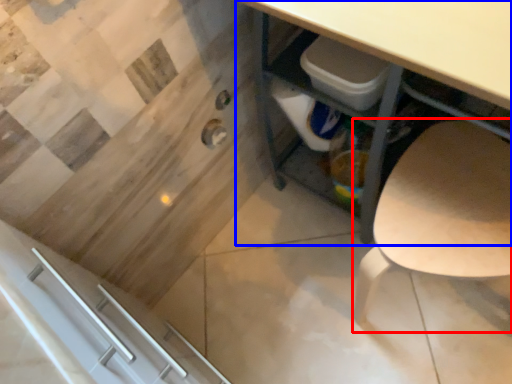
Question: Which object is closer to the camera taking this photo, chair (highlighted by a red box) or desk (highlighted by a blue box)?

Choices:
 (A) chair
 (B) desk

Answer: (B)